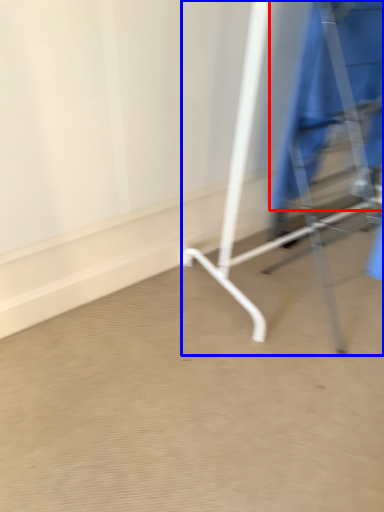
Question: Which of the following is the closest to the observer, robe (highlighted by a red box) or furniture (highlighted by a blue box)?

Choices:
 (A) robe
 (B) furniture

Answer: (B)